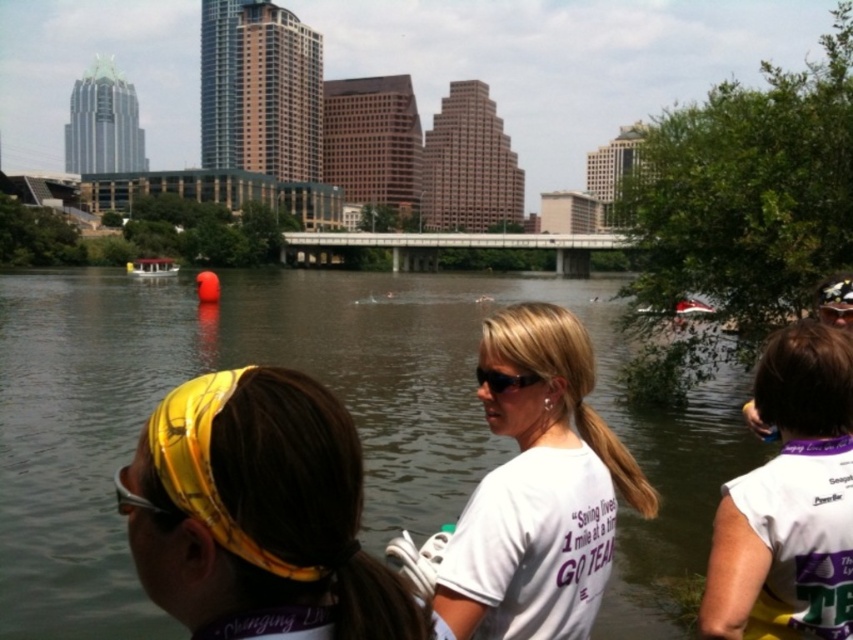
Can you confirm if yellow printed bandana at upper left is positioned below white matte t-shirt at center?

Yes, yellow printed bandana at upper left is below white matte t-shirt at center.

Between yellow printed bandana at upper left and white matte t-shirt at center, which one is positioned higher?

Positioned higher is white matte t-shirt at center.

Does point (236, 376) come in front of point (579, 525)?

Yes, it is in front of point (579, 525).

Locate an element on the screen. yellow printed bandana at upper left is located at coordinates (x=260, y=515).

Does white plastic boat at upper right have a smaller size compared to yellow fabric headband at upper right?

No, white plastic boat at upper right is not smaller than yellow fabric headband at upper right.

Which of these two, white plastic boat at upper right or yellow fabric headband at upper right, stands shorter?

With less height is yellow fabric headband at upper right.

Locate an element on the screen. The width and height of the screenshot is (853, 640). white plastic boat at upper right is located at coordinates (692, 307).

Can you confirm if greenish water at center is shorter than yellow printed bandana at upper left?

No.

Is greenish water at center positioned at the back of yellow printed bandana at upper left?

Yes, it is behind yellow printed bandana at upper left.

Does point (132, 428) come farther from viewer compared to point (160, 540)?

That is True.

Find the location of a particular element. Image resolution: width=853 pixels, height=640 pixels. greenish water at center is located at coordinates (341, 400).